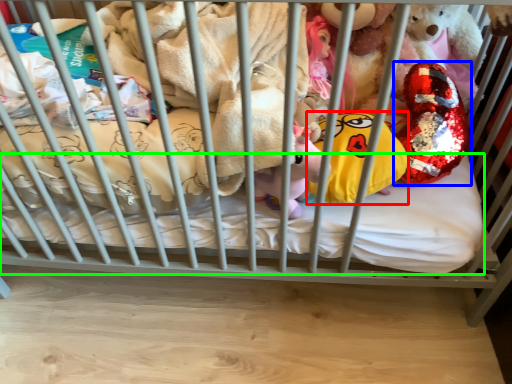
Question: Based on their relative distances, which object is farther from pillow (highlighted by a red box)? Choose from toy (highlighted by a blue box) and mattress (highlighted by a green box).

Choices:
 (A) toy
 (B) mattress

Answer: (B)